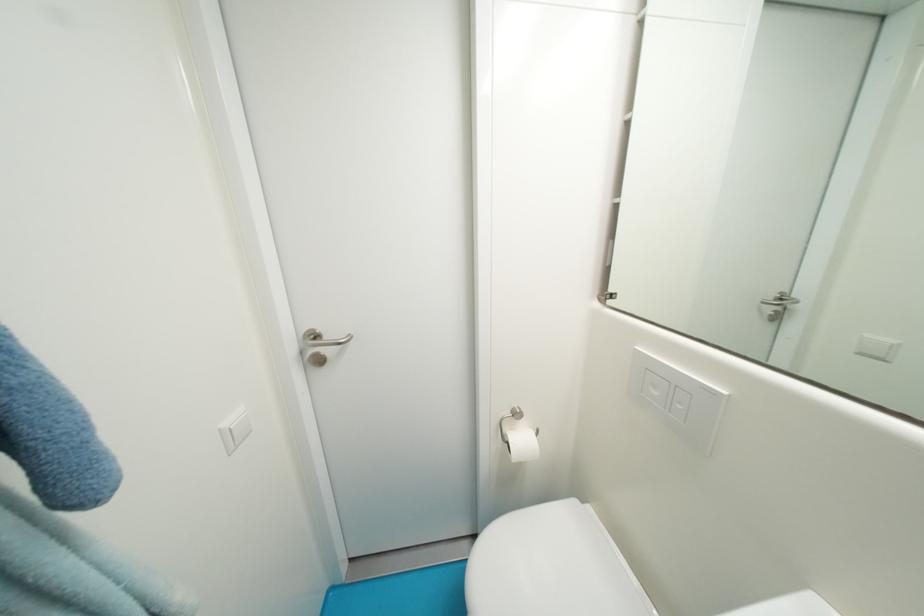
This screenshot has height=616, width=924. What do you see at coordinates (777, 305) in the screenshot?
I see `the mirrored cabinet door` at bounding box center [777, 305].